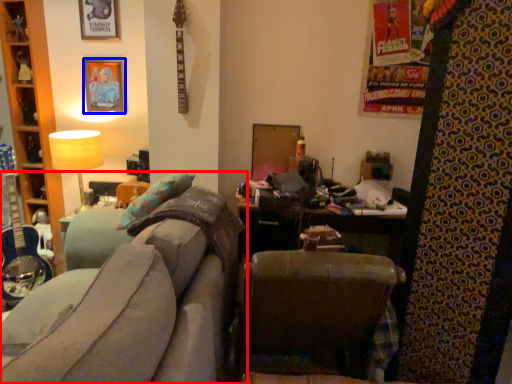
Question: Which point is closer to the camera, studio couch (highlighted by a red box) or picture frame (highlighted by a blue box)?

Choices:
 (A) studio couch
 (B) picture frame

Answer: (A)